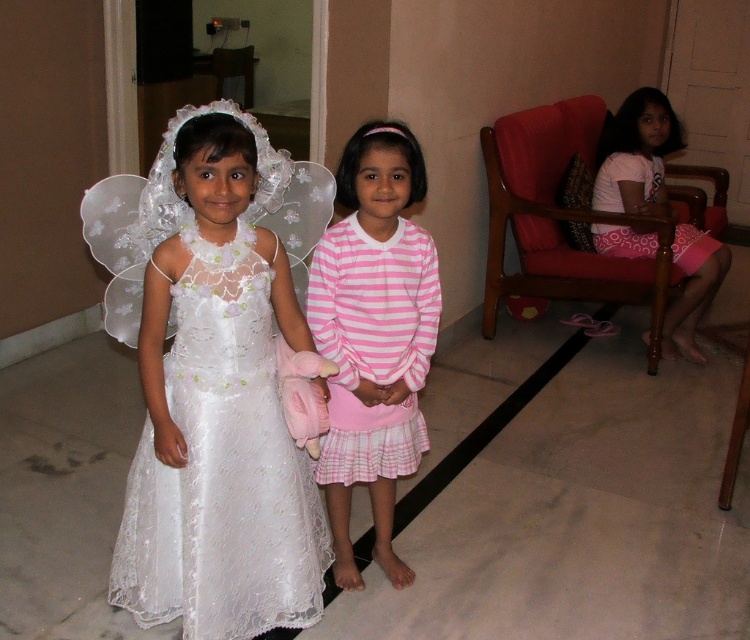
Question: From the image, what is the correct spatial relationship of pink striped dress at center in relation to pink fabric dress at right?

Choices:
 (A) right
 (B) left

Answer: (B)

Question: Which of these objects is positioned farthest from the white lace dress at left?

Choices:
 (A) pink striped dress at center
 (B) pink fabric dress at right

Answer: (B)

Question: Which point is closer to the camera?

Choices:
 (A) (212, 312)
 (B) (322, 484)
 (C) (606, 180)

Answer: (A)

Question: Which of the following is the farthest from the observer?

Choices:
 (A) (309, 275)
 (B) (198, 380)
 (C) (720, 243)

Answer: (C)

Question: In this image, where is white lace dress at left located relative to pink fabric dress at right?

Choices:
 (A) above
 (B) below

Answer: (B)

Question: Can you confirm if white lace dress at left is positioned to the left of pink striped dress at center?

Choices:
 (A) yes
 (B) no

Answer: (A)